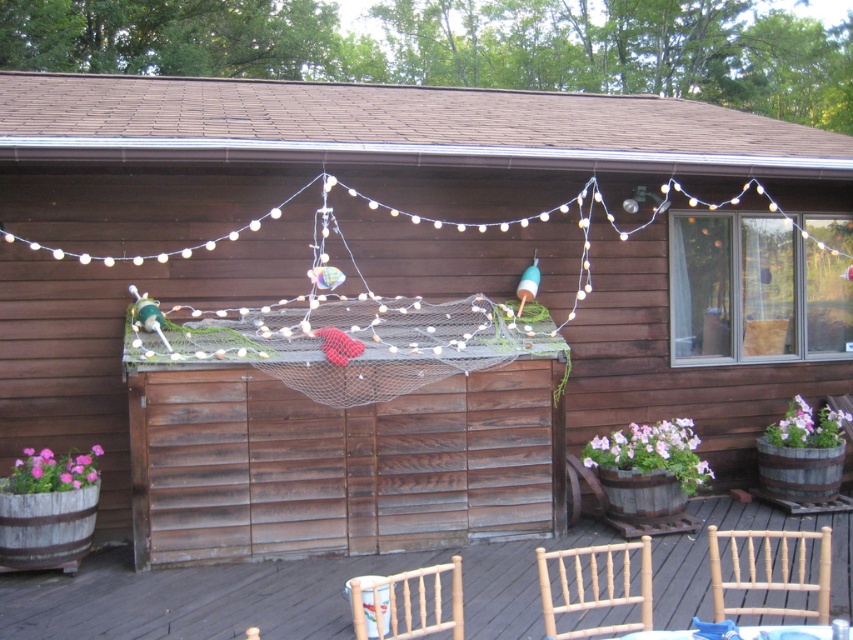
Question: Estimate the real-world distances between objects in this image. Which object is farther from the white plastic table at lower center?

Choices:
 (A) bamboo chair at lower center
 (B) light brown wooden chair at lower center
 (C) wooden chairs at lower center
 (D) light brown wooden chair at lower right

Answer: (C)

Question: Can you confirm if wooden chairs at lower center is positioned above white plastic table at lower center?

Choices:
 (A) no
 (B) yes

Answer: (A)

Question: Is wooden chairs at lower center positioned in front of light brown wooden chair at lower center?

Choices:
 (A) no
 (B) yes

Answer: (A)

Question: Which object is positioned farthest from the wooden chairs at lower center?

Choices:
 (A) bamboo chair at lower center
 (B) light brown wooden chair at lower center
 (C) white plastic table at lower center
 (D) light brown wooden chair at lower right

Answer: (C)

Question: From the image, what is the correct spatial relationship of wooden chairs at lower center in relation to bamboo chair at lower center?

Choices:
 (A) right
 (B) left

Answer: (B)

Question: Which of the following is the closest to the observer?

Choices:
 (A) (724, 624)
 (B) (434, 627)
 (C) (483, 596)
 (D) (827, 608)

Answer: (A)